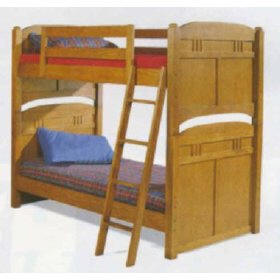
This screenshot has height=280, width=280. In order to click on wood ladder in this screenshot , I will do `click(136, 228)`.